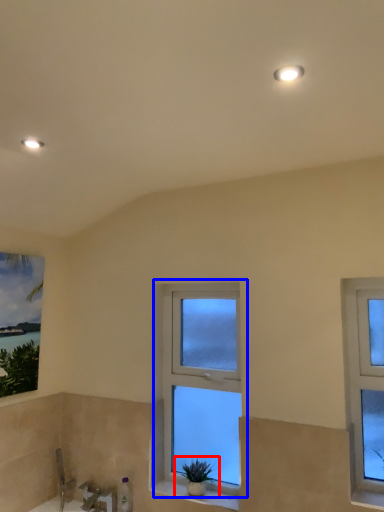
Question: Which object appears farthest to the camera in this image, houseplant (highlighted by a red box) or window (highlighted by a blue box)?

Choices:
 (A) houseplant
 (B) window

Answer: (B)